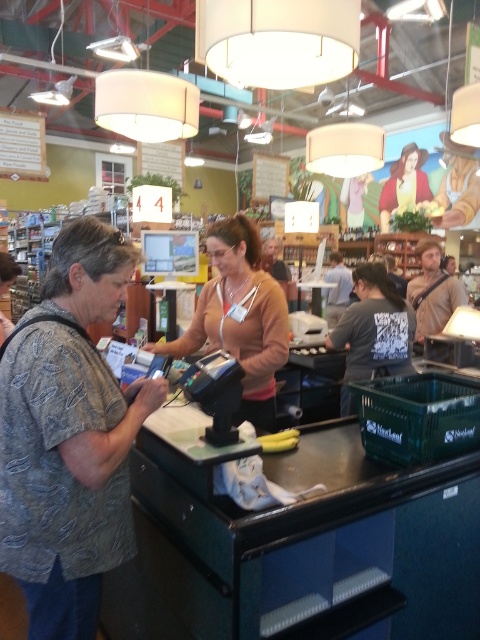
Question: Based on their relative distances, which object is nearer to the dark gray sweater at center?

Choices:
 (A) wooden signboard at upper left
 (B) brown leather bag at center
 (C) gray printed shirt at left

Answer: (B)

Question: Which object is positioned farthest from the dark gray t-shirt at center?

Choices:
 (A) brown leather bag at center
 (B) dark gray sweater at center

Answer: (B)

Question: Can you confirm if matte brown sweater at center is thinner than brown leather bag at center?

Choices:
 (A) no
 (B) yes

Answer: (A)

Question: Is the position of gray printed shirt at left more distant than that of wooden signboard at upper left?

Choices:
 (A) yes
 (B) no

Answer: (B)

Question: Which object appears closest to the camera in this image?

Choices:
 (A) wooden signboard at upper left
 (B) matte brown sweater at center

Answer: (B)

Question: Is gray printed shirt at left wider than dark gray t-shirt at center?

Choices:
 (A) yes
 (B) no

Answer: (B)